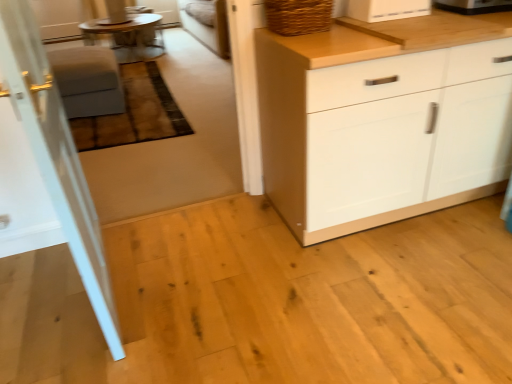
Question: Can you confirm if white glossy door at left is bigger than black plastic toaster at upper right, which is the second appliance from left to right?

Choices:
 (A) no
 (B) yes

Answer: (B)

Question: Is white glossy door at left not within black plastic toaster at upper right, which is the second appliance from left to right?

Choices:
 (A) no
 (B) yes

Answer: (B)

Question: From a real-world perspective, is white glossy door at left positioned over black plastic toaster at upper right, which is the second appliance from left to right, based on gravity?

Choices:
 (A) yes
 (B) no

Answer: (B)

Question: Does white glossy door at left appear on the left side of black plastic toaster at upper right, which is counted as the 1th appliance, starting from the right?

Choices:
 (A) yes
 (B) no

Answer: (A)

Question: Does white glossy door at left have a greater width compared to black plastic toaster at upper right, which is counted as the 1th appliance, starting from the right?

Choices:
 (A) no
 (B) yes

Answer: (A)

Question: Does point (456, 91) appear closer or farther from the camera than point (94, 291)?

Choices:
 (A) closer
 (B) farther

Answer: (B)

Question: From the image's perspective, relative to white glossy door at left, is white matte cabinet at center above or below?

Choices:
 (A) above
 (B) below

Answer: (A)

Question: Would you say white matte cabinet at center is to the left or to the right of white glossy door at left in the picture?

Choices:
 (A) right
 (B) left

Answer: (A)

Question: In the image, is white matte cabinet at center positioned in front of or behind white glossy door at left?

Choices:
 (A) behind
 (B) front

Answer: (A)

Question: From the image's perspective, is white matte cabinet at center positioned above or below white glossy toaster at upper center, placed as the 1th appliance when sorted from left to right?

Choices:
 (A) below
 (B) above

Answer: (A)

Question: Considering the positions of white matte cabinet at center and white glossy toaster at upper center, placed as the 1th appliance when sorted from left to right, in the image, is white matte cabinet at center bigger or smaller than white glossy toaster at upper center, placed as the 1th appliance when sorted from left to right,?

Choices:
 (A) big
 (B) small

Answer: (A)

Question: Would you say white matte cabinet at center is to the left or to the right of white glossy toaster at upper center, placed as the 1th appliance when sorted from left to right, in the picture?

Choices:
 (A) right
 (B) left

Answer: (A)

Question: In terms of width, does white matte cabinet at center look wider or thinner when compared to white glossy toaster at upper center, placed as the 1th appliance when sorted from left to right?

Choices:
 (A) wide
 (B) thin

Answer: (A)

Question: Is point (105, 87) positioned closer to the camera than point (138, 48)?

Choices:
 (A) closer
 (B) farther

Answer: (A)

Question: From a real-world perspective, is matte gray stool at left positioned above or below wooden round table at upper left?

Choices:
 (A) above
 (B) below

Answer: (A)